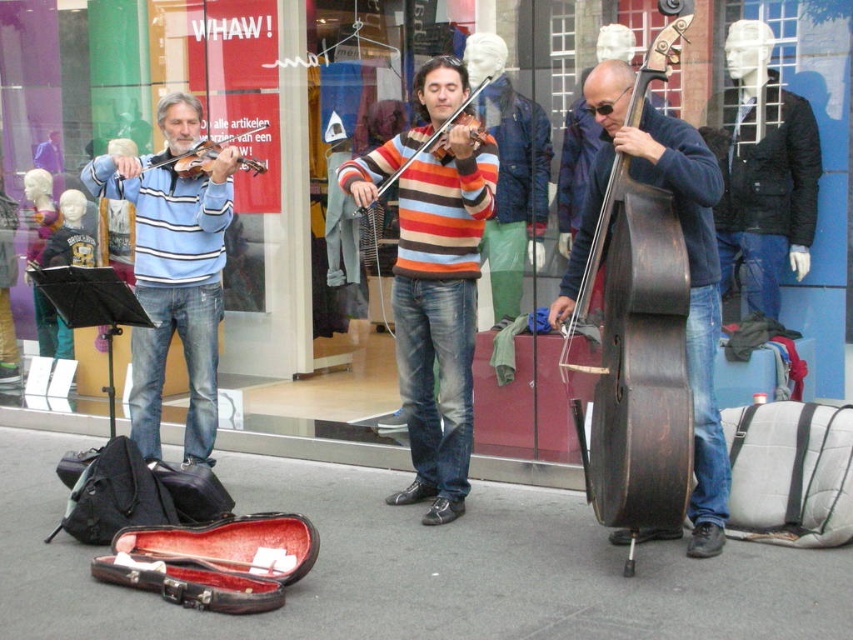
Question: Which of the following is the closest to the observer?

Choices:
 (A) (492, 76)
 (B) (735, 202)
 (C) (64, 554)
 (D) (137, 340)

Answer: (C)

Question: Does light blue striped sweater at left have a lesser width compared to black quilted jacket at upper right?

Choices:
 (A) no
 (B) yes

Answer: (A)

Question: Is smooth asphalt pavement at center to the right of striped sweater at center from the viewer's perspective?

Choices:
 (A) yes
 (B) no

Answer: (B)

Question: Which of the following is the farthest from the observer?

Choices:
 (A) dark brown polished wood cello at right
 (B) wooden violin at center

Answer: (B)

Question: Which point is closer to the camera?

Choices:
 (A) dark brown polished wood cello at right
 (B) black quilted jacket at upper right
 (C) matte black violin at left

Answer: (A)

Question: Does smooth asphalt pavement at center appear under light blue striped sweater at left?

Choices:
 (A) no
 (B) yes

Answer: (B)